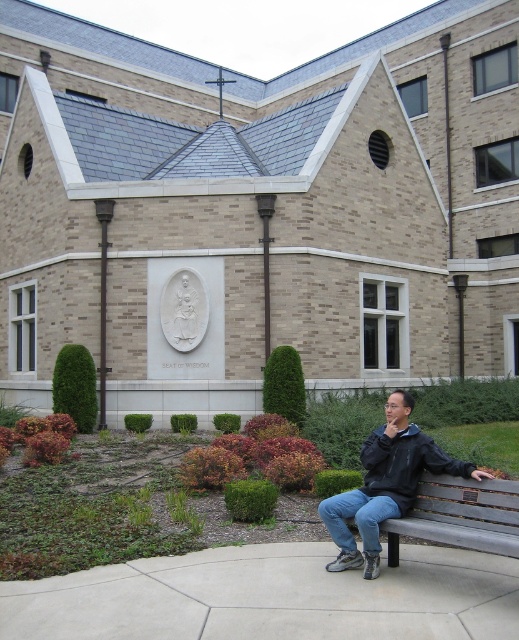
Question: Which object is the closest to the metallic plaque at lower right?

Choices:
 (A) black matte jacket at lower right
 (B) wooden bench at lower right

Answer: (B)

Question: Considering the relative positions of black matte jacket at lower right and metallic plaque at lower right in the image provided, where is black matte jacket at lower right located with respect to metallic plaque at lower right?

Choices:
 (A) below
 (B) above

Answer: (A)

Question: Considering the real-world distances, which object is farthest from the black matte jacket at lower right?

Choices:
 (A) metallic plaque at lower right
 (B) wooden bench at lower right

Answer: (A)

Question: Can you confirm if black matte jacket at lower right is wider than metallic plaque at lower right?

Choices:
 (A) yes
 (B) no

Answer: (A)

Question: Which point is farther from the camera taking this photo?

Choices:
 (A) (438, 525)
 (B) (477, 493)
 (C) (368, 579)

Answer: (C)

Question: Does black matte jacket at lower right appear on the left side of metallic plaque at lower right?

Choices:
 (A) yes
 (B) no

Answer: (A)